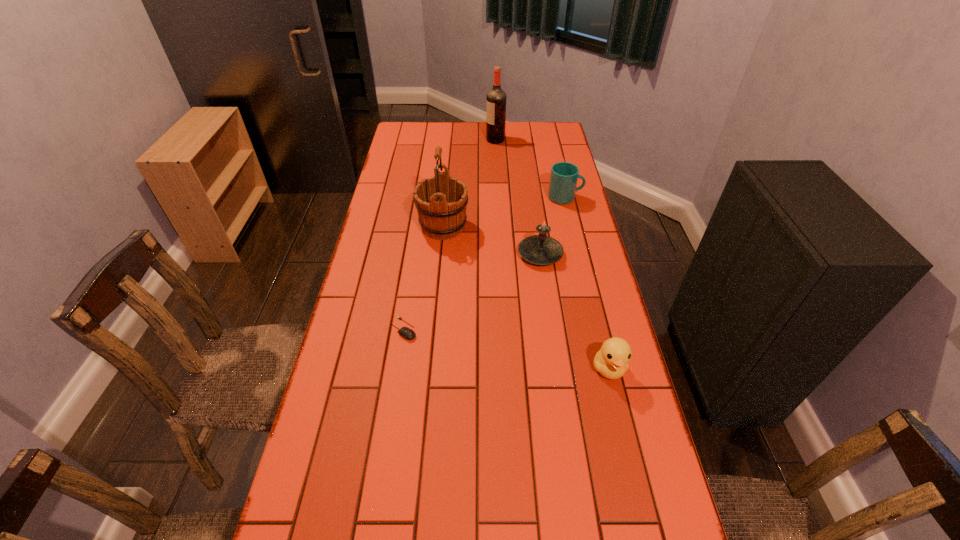
You are a GUI agent. You are given a task and a screenshot of the screen. Output one action in this format:
    pyautogui.click(x=<x>, y=<y>)
    Task: Click on the vacant area at the left edge
    The image size is (960, 540).
    Given the screenshot: What is the action you would take?
    pyautogui.click(x=340, y=472)

Locate an element on the screen. vacant area at the right edge of the desktop is located at coordinates (587, 447).

Locate an element on the screen. free space at the far right corner of the desktop is located at coordinates click(x=550, y=144).

Identify the location of unoccupied area between the fifth nearest object and the wine bucket. (504, 212).

The height and width of the screenshot is (540, 960). In order to click on vacant area that lies between the candle and the fifth nearest object in this screenshot , I will do `click(553, 226)`.

Identify the location of vacant point located between the cup and the wine bucket. This screenshot has height=540, width=960. (504, 212).

Find the location of a particular element. This screenshot has width=960, height=540. vacant area between the mouse and the candle is located at coordinates (472, 292).

Locate an element on the screen. The width and height of the screenshot is (960, 540). vacant area that lies between the candle and the duck is located at coordinates pyautogui.click(x=574, y=311).

Where is `vacant space in between the shortest object and the wine bucket`? The image size is (960, 540). vacant space in between the shortest object and the wine bucket is located at coordinates (423, 278).

Identify the location of vacant area that lies between the candle and the duck. Image resolution: width=960 pixels, height=540 pixels. (574, 311).